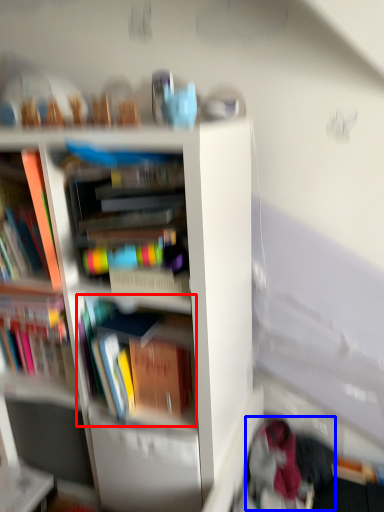
Question: Which point is closer to the camera, book (highlighted by a red box) or clothing (highlighted by a blue box)?

Choices:
 (A) book
 (B) clothing

Answer: (A)